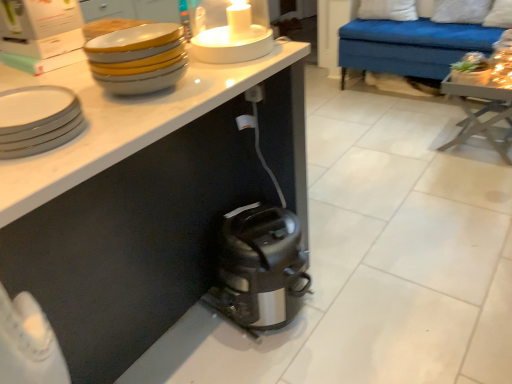
Question: Based on their positions, is white glossy candle holder at upper center located to the left or right of white glossy plate at upper left, positioned as the 1th tableware in bottom-to-top order?

Choices:
 (A) right
 (B) left

Answer: (A)

Question: Looking at the image, does white glossy candle holder at upper center seem bigger or smaller compared to white glossy plate at upper left, positioned as the 1th tableware in bottom-to-top order?

Choices:
 (A) big
 (B) small

Answer: (A)

Question: Considering the real-world distances, which object is farthest from the white soft pillow at upper right, which is the second pillow in left-to-right order?

Choices:
 (A) white glossy bowls at upper left, which is the 1th tableware from top to bottom
 (B) white glossy candle holder at upper center
 (C) wooden table at right
 (D) white glossy plate at upper left, the 2th tableware when ordered from top to bottom
 (E) matte white bowl at lower right

Answer: (D)

Question: Which is nearer to the satin silver toaster at lower center?

Choices:
 (A) white glossy plate at upper left, positioned as the 1th tableware in bottom-to-top order
 (B) wooden table at right
 (C) white soft pillow at upper right, which is the second pillow in left-to-right order
 (D) matte white bowl at lower right
 (E) satin black toaster at lower center

Answer: (E)